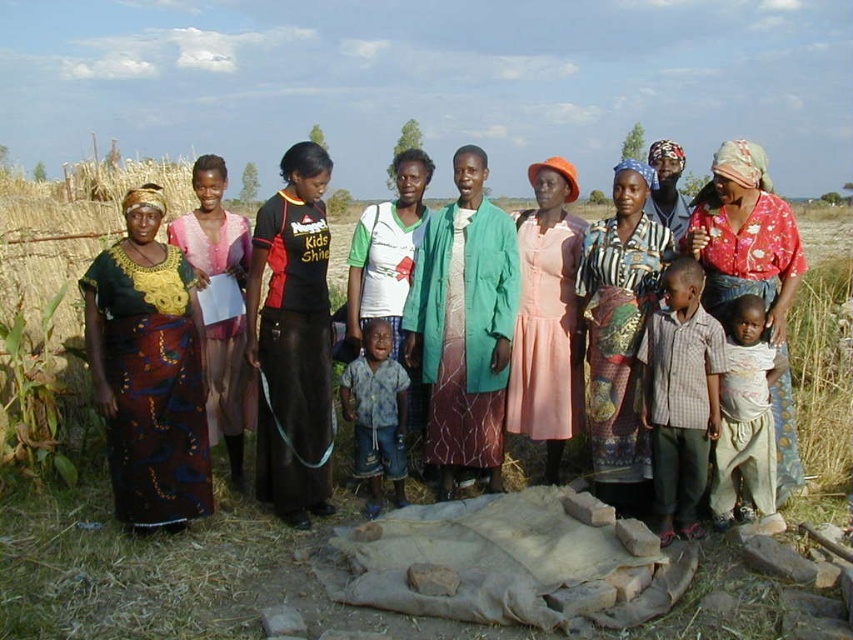
Does floral printed blouse at center have a lesser height compared to plaid cotton shirt at center?

No, floral printed blouse at center is not shorter than plaid cotton shirt at center.

Who is more forward, (727,275) or (663,534)?

Positioned in front is point (663,534).

This screenshot has width=853, height=640. Find the location of `floral printed blouse at center`. floral printed blouse at center is located at coordinates (746, 236).

Is black matte skirt at center behind floral printed blouse at center?

Yes, black matte skirt at center is further from the viewer.

Can you confirm if black matte skirt at center is positioned to the left of floral printed blouse at center?

Correct, you'll find black matte skirt at center to the left of floral printed blouse at center.

Is point (263, 268) closer to viewer compared to point (759, 156)?

No.

Find the location of a particular element. The image size is (853, 640). black matte skirt at center is located at coordinates pyautogui.click(x=292, y=339).

Is striped fabric dress at center shorter than matte yellow dress at left?

Yes, striped fabric dress at center is shorter than matte yellow dress at left.

Between striped fabric dress at center and matte yellow dress at left, which one has less height?

Standing shorter between the two is striped fabric dress at center.

Between point (653, 170) and point (193, 252), which one is positioned behind?

The point (193, 252) is behind.

Locate an element on the screen. This screenshot has width=853, height=640. striped fabric dress at center is located at coordinates (619, 330).